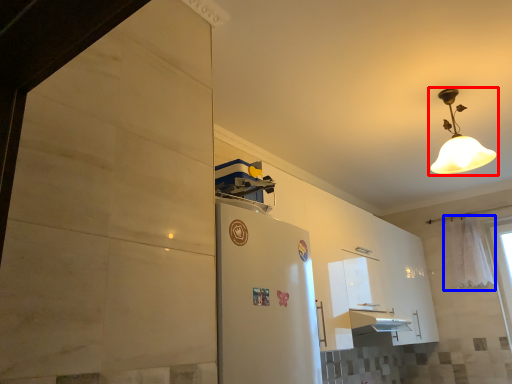
Question: Which object appears farthest to the camera in this image, lamp (highlighted by a red box) or curtain (highlighted by a blue box)?

Choices:
 (A) lamp
 (B) curtain

Answer: (B)